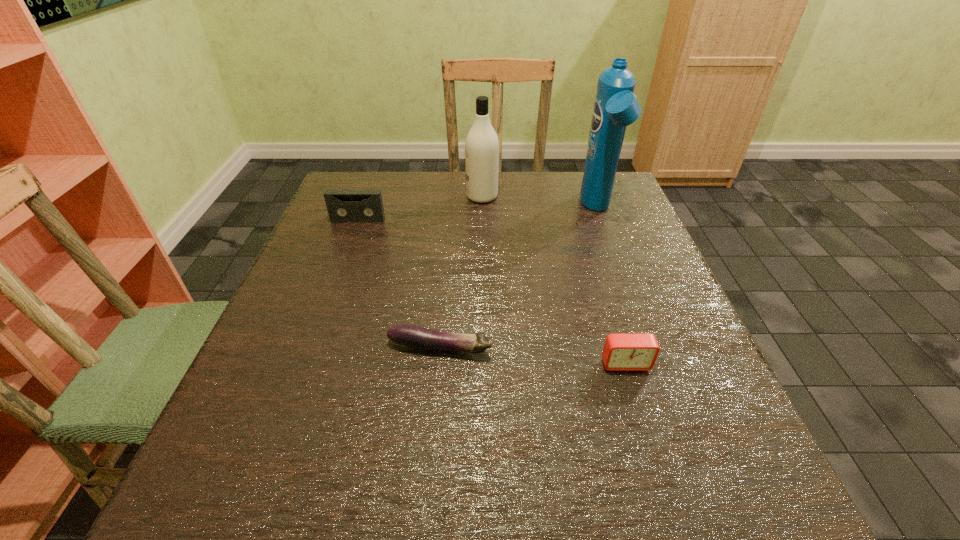
Where is `the tallest object`? the tallest object is located at coordinates (615, 107).

At what (x,y) coordinates should I click in order to perform the action: click on the taller shampoo. Please return your answer as a coordinate pair (x, y). Looking at the image, I should click on (615, 107).

Locate an element on the screen. the fourth shortest object is located at coordinates (481, 145).

Where is `the left shampoo`? This screenshot has height=540, width=960. the left shampoo is located at coordinates (481, 145).

You are a GUI agent. You are given a task and a screenshot of the screen. Output one action in this format:
    pyautogui.click(x=<x>, y=<y>)
    Task: Click on the videotape
    The height and width of the screenshot is (540, 960).
    Given the screenshot: What is the action you would take?
    pyautogui.click(x=344, y=206)

The width and height of the screenshot is (960, 540). I want to click on the leftmost object, so click(344, 206).

I want to click on the fourth tallest object, so click(622, 352).

This screenshot has width=960, height=540. I want to click on eggplant, so click(x=412, y=336).

At what (x,y) coordinates should I click in order to perform the action: click on vacant area situated 0.240m on the front of the tallest object. Please return your answer as a coordinate pair (x, y). Looking at the image, I should click on (631, 301).

This screenshot has height=540, width=960. I want to click on free space located on the front-facing side of the left shampoo, so click(x=371, y=197).